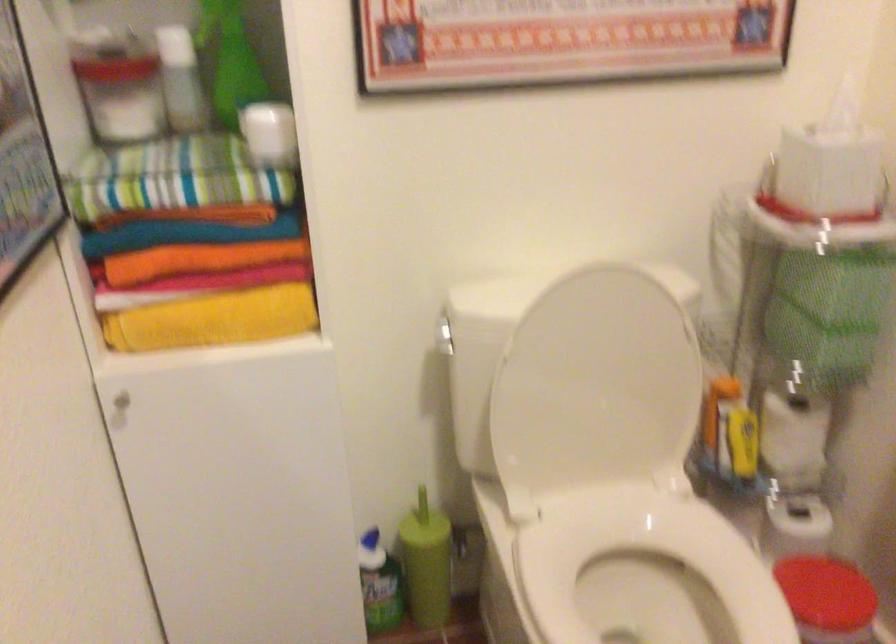
Where would you lift the white toilet seat? Please return your answer as a coordinate pair (x, y).

(648, 578)